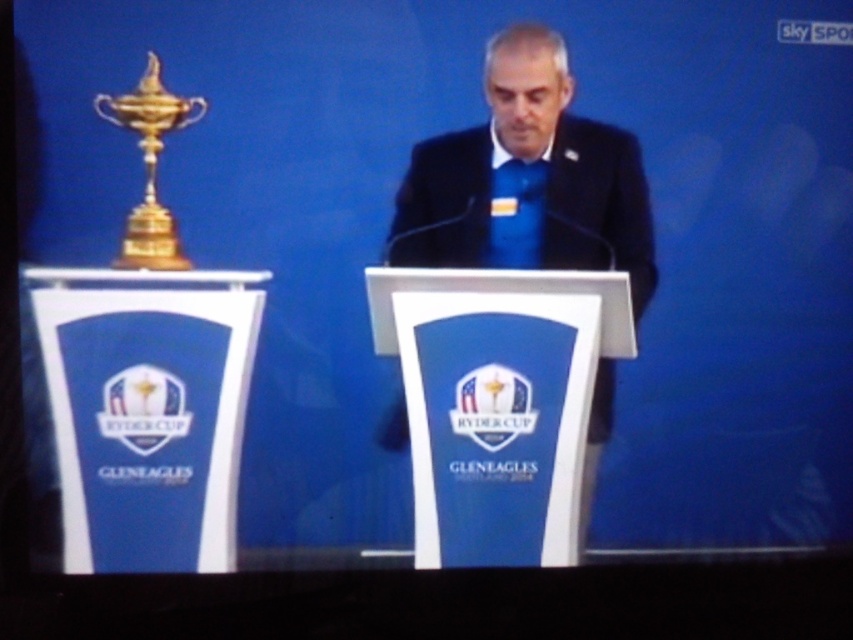
Consider the image. Does blue satin suit at center lie behind gold polished metal trophy at left?

Yes.

Is point (421, 228) positioned after point (173, 221)?

Yes, it is behind point (173, 221).

Which is in front, point (486, 141) or point (170, 257)?

Point (170, 257) is more forward.

This screenshot has width=853, height=640. I want to click on blue satin suit at center, so coord(527,179).